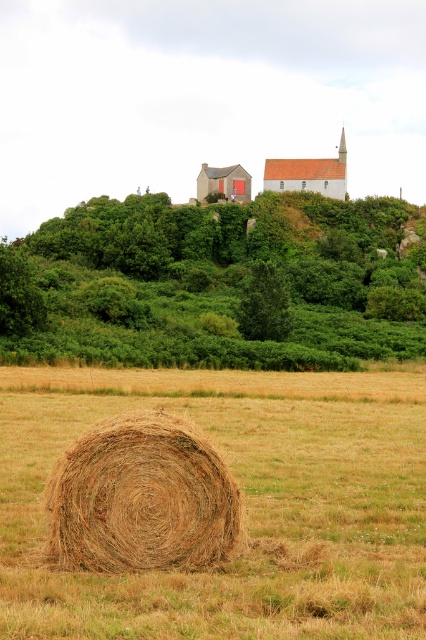
Question: Among these points, which one is farthest from the camera?

Choices:
 (A) (313, 186)
 (B) (86, 202)
 (C) (46, 508)
 (D) (273, 609)

Answer: (B)

Question: Does green leafy hillside at upper center have a smaller size compared to red brick church at upper center?

Choices:
 (A) no
 (B) yes

Answer: (A)

Question: Which point is closer to the camera taking this photo?

Choices:
 (A) click(236, 493)
 (B) click(74, 356)
 (C) click(264, 180)

Answer: (A)

Question: Is golden straw bale at center further to camera compared to red brick church at upper center?

Choices:
 (A) no
 (B) yes

Answer: (A)

Question: Is green leafy hillside at upper center above golden straw bale at center?

Choices:
 (A) yes
 (B) no

Answer: (A)

Question: Which point is closer to the camera taking this photo?

Choices:
 (A) (327, 186)
 (B) (120, 460)
 (C) (11, 467)

Answer: (B)